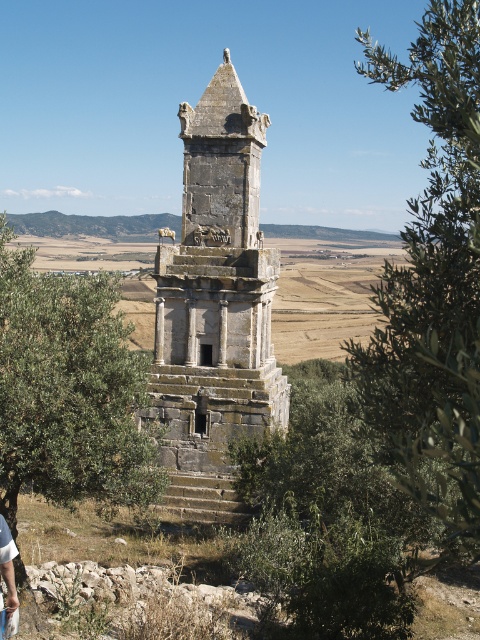
Question: Which of the following is the closest to the observer?

Choices:
 (A) (432, 99)
 (B) (216, 192)
 (C) (0, 557)
 (D) (83, 298)

Answer: (A)

Question: Which point is closer to the camera?

Choices:
 (A) (3, 525)
 (B) (212, 269)

Answer: (A)

Question: Which object appears farthest from the camera in this image?

Choices:
 (A) green leafy tree at center right
 (B) green leafy tree at center
 (C) stone tower at center

Answer: (C)

Question: Is stone tower at center above light brown leather pants at lower left?

Choices:
 (A) no
 (B) yes

Answer: (B)

Question: Can you confirm if stone tower at center is positioned below green leafy tree at center?

Choices:
 (A) yes
 (B) no

Answer: (B)

Question: Is green leafy tree at center right smaller than green leafy tree at center?

Choices:
 (A) yes
 (B) no

Answer: (B)